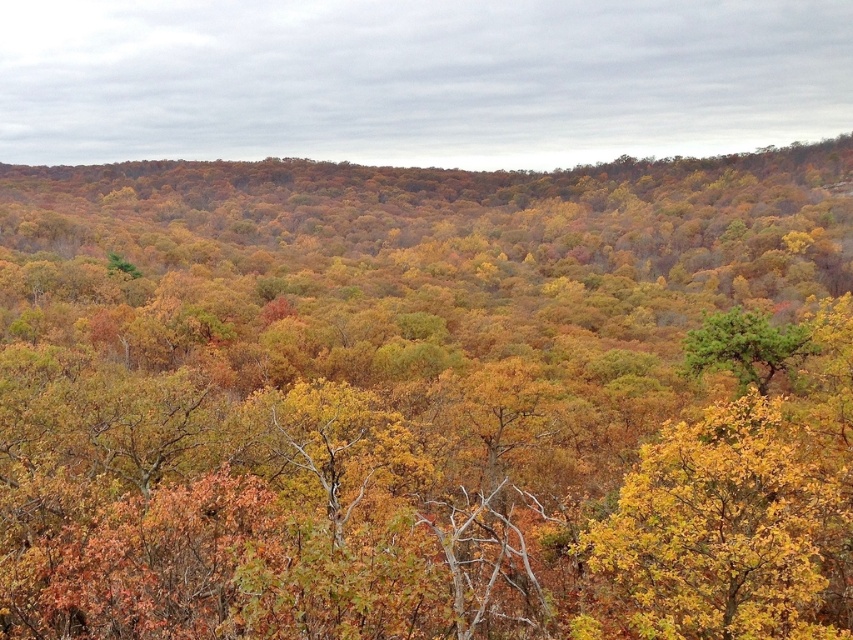
Question: From the image, what is the correct spatial relationship of yellow-green foliage at center-right in relation to green textured tree at center?

Choices:
 (A) below
 (B) above

Answer: (A)

Question: From the image, what is the correct spatial relationship of yellow-green foliage at center-right in relation to green textured tree at center?

Choices:
 (A) below
 (B) above

Answer: (A)

Question: Does yellow-green foliage at center-right lie in front of green textured tree at center?

Choices:
 (A) no
 (B) yes

Answer: (B)

Question: Which point is farther from the camera taking this photo?

Choices:
 (A) (733, 317)
 (B) (674, 570)

Answer: (A)